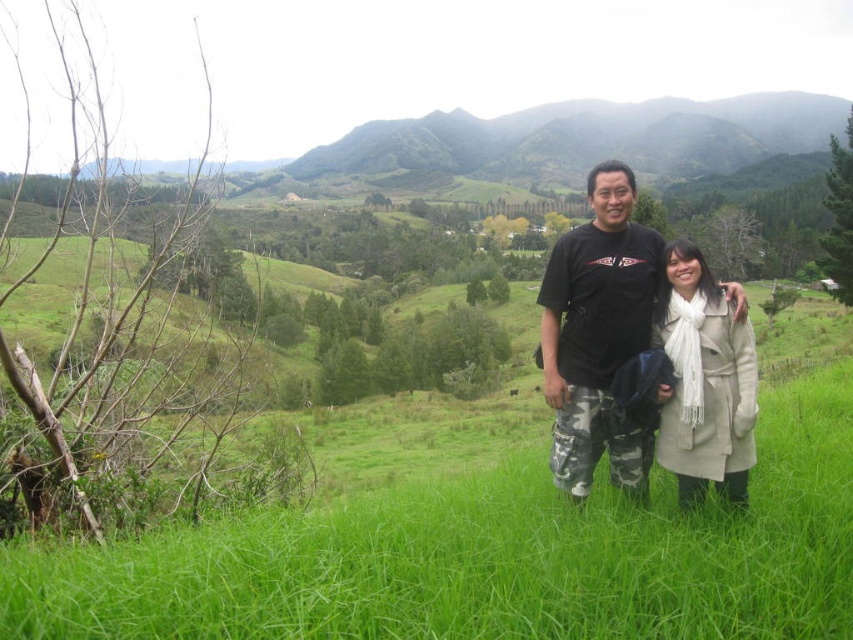
You are a photographer trying to capture a photo of both the camouflage pants at center and the beige wool coat at center. Since you want them both in the frame, which direction should you move to ensure both are visible?

You should move to the left to ensure both the camouflage pants at center and the beige wool coat at center are visible, as the camouflage pants at center is to the right of the beige wool coat at center.

You are a photographer trying to capture a group photo of the camouflage pants at center and the beige wool coat at center. If your camera has a maximum focus range of 3 feet, will both subjects be in focus?

The camouflage pants at center is 3.37 feet from beige wool depth of field at center, so the distance between them is 3.37 feet. Since the camera can only focus up to 3 feet, the subjects are slightly out of the focus range. Therefore, both subjects may not be in focus simultaneously.

You are standing in the middle of the grassy field and want to place a small picnic basket exactly where the camouflage pants at center are located. What are the coordinates where you should place the basket?

The coordinates for the camouflage pants at center are at point (599, 333), so you should place the picnic basket there.